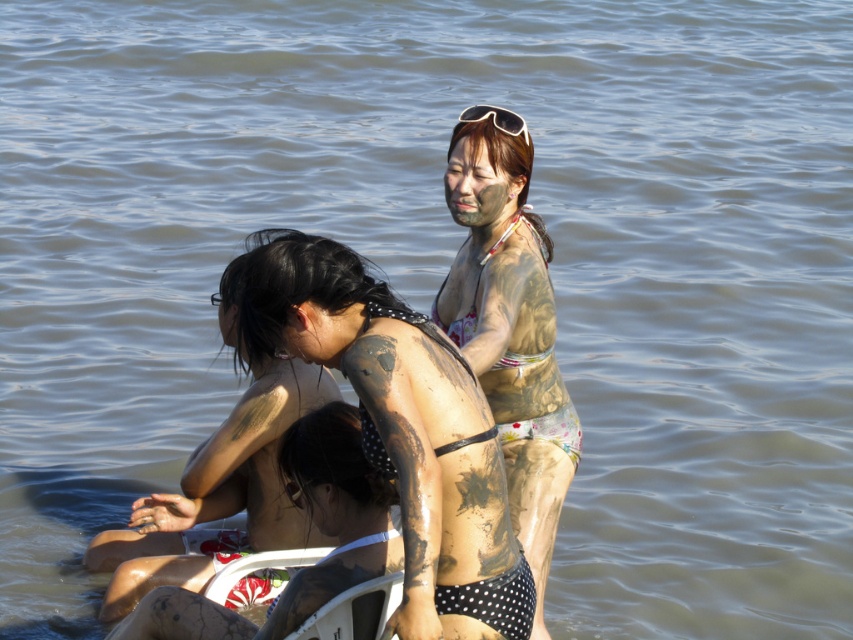
Does point (172, 605) come farther from viewer compared to point (450, 163)?

No, it is not.

Is dark brown mud at center wider than matte mud face at center?

Yes.

Locate an element on the screen. The height and width of the screenshot is (640, 853). dark brown mud at center is located at coordinates pos(314,522).

In the scene shown: Which of these two, matte black bikini at center or dark brown mud at center, stands taller?

matte black bikini at center

Is point (439, 467) in front of point (276, 632)?

Yes, point (439, 467) is in front of point (276, 632).

Which is behind, point (264, 262) or point (369, 563)?

Positioned behind is point (369, 563).

This screenshot has width=853, height=640. In order to click on matte black bikini at center in this screenshot , I will do `click(399, 426)`.

Is muddy skin bikini at upper center thinner than matte skin at center?

Incorrect, muddy skin bikini at upper center's width is not less than matte skin at center's.

Does point (544, 353) come farther from viewer compared to point (294, 317)?

That is True.

The image size is (853, 640). In order to click on muddy skin bikini at upper center in this screenshot , I will do `click(509, 332)`.